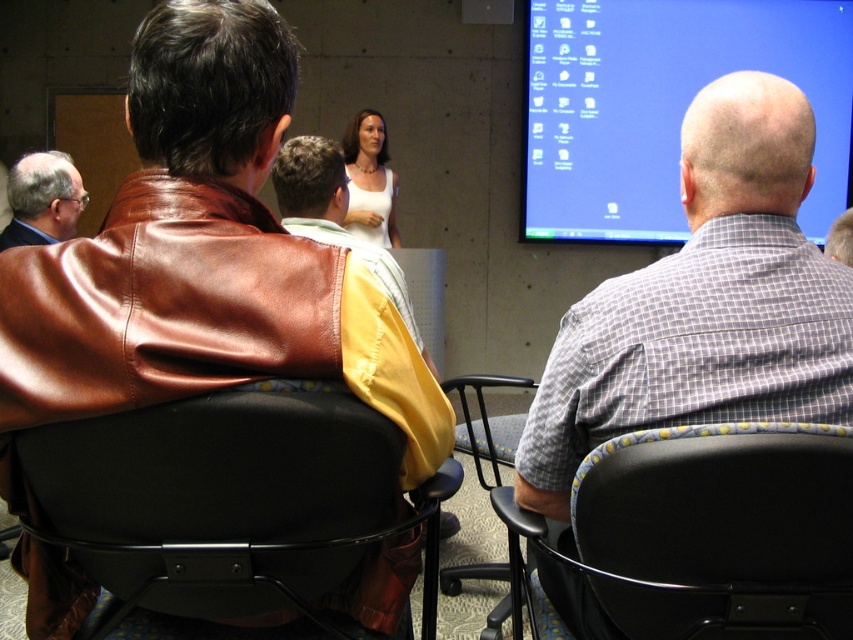
You are organizing a small event and need to seat two guests. You have two chairs available in the room shown in the image. Which chair between the black leather chair at lower left and the black plastic chair at lower right would provide more seating space for a guest who requires extra comfort?

The black leather chair at lower left is bigger than the black plastic chair at lower right, so it would provide more seating space and comfort for the guest.

You are sitting in the black plastic chair at center and want to see the speaker at the podium. Is the black leather chair at lower left blocking your view?

The black leather chair at lower left is in front of the black plastic chair at center, so it is blocking your view of the speaker at the podium.

You are sitting in the front row of the presentation and want to pass a note to the person wearing the gray checkered shirt at right. You have to go around either the black plastic chair at lower right or through the space between them. Which path is shorter?

The gray checkered shirt at right is further to the viewer than the black plastic chair at lower right, so the path around the black plastic chair at lower right is shorter.